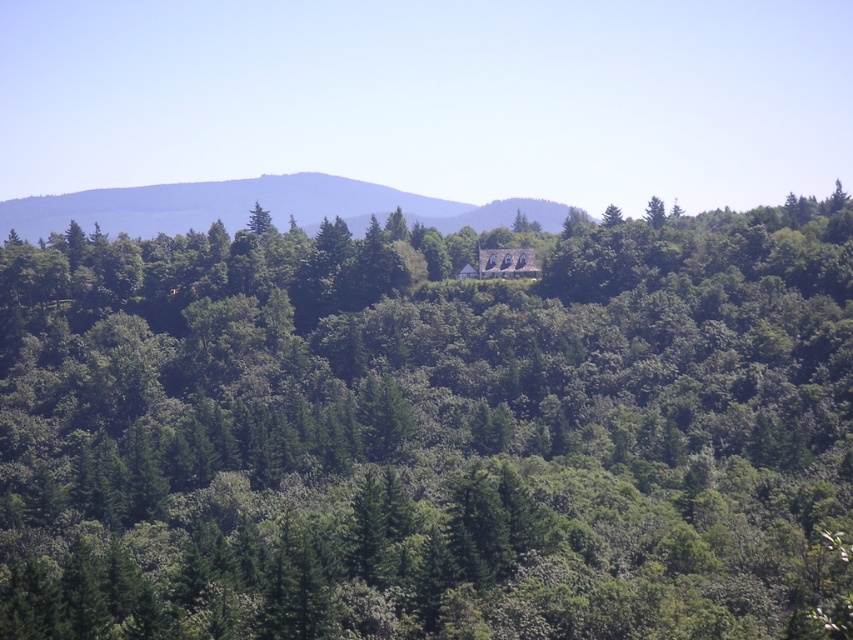
You are planning to plant a new tree in this landscape. The space available is only wide enough for a tree that is narrower than the green leafy hillside at center. Can the green leafy tree at center fit in that space?

The green leafy tree at center is narrower than the green leafy hillside at center, so it can fit in the space.

You are standing at the point marked by the coordinates point (428,428) in the image. What is the closest object to you?

The point (428,428) corresponds to the green leafy tree at center, so the closest object to you is the green leafy tree at center.